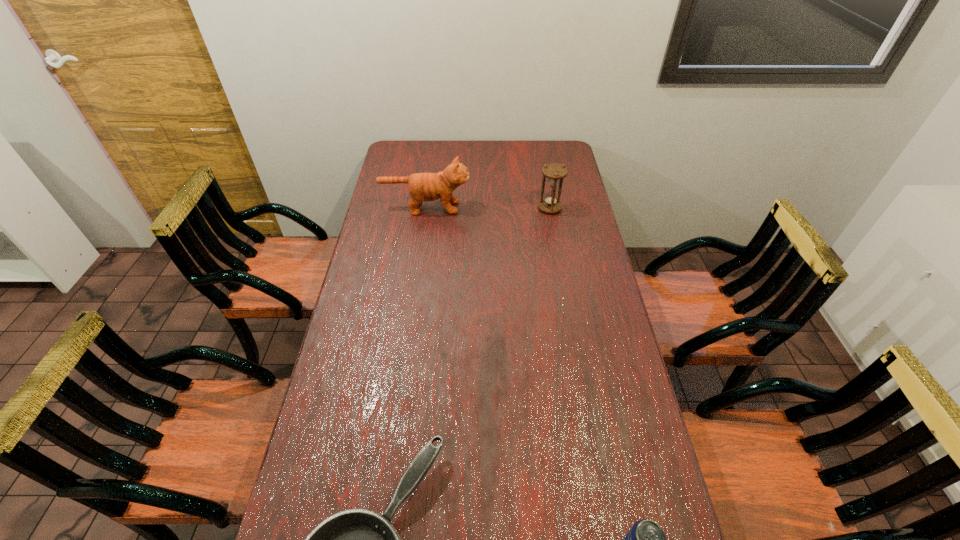
Where is `vacant region at the far right corner`? This screenshot has width=960, height=540. vacant region at the far right corner is located at coordinates (559, 153).

The image size is (960, 540). I want to click on empty space that is in between the hourglass and the cat, so click(x=488, y=208).

Locate an element on the screen. Image resolution: width=960 pixels, height=540 pixels. unoccupied area between the cat and the second tallest object is located at coordinates (488, 208).

What are the coordinates of `object that can be found as the second closest to the third shortest object` in the screenshot? It's located at (356, 539).

This screenshot has width=960, height=540. Identify the location of object identified as the second closest to the cat. (356, 539).

The width and height of the screenshot is (960, 540). What are the coordinates of `vacant position in the image that satisfies the following two spatial constraints: 1. on the face of the cat; 2. on the back side of the third shortest object` in the screenshot? It's located at (425, 208).

Find the location of a particular element. The image size is (960, 540). vacant space that satisfies the following two spatial constraints: 1. on the face of the hourglass; 2. on the left side of the cat is located at coordinates (425, 208).